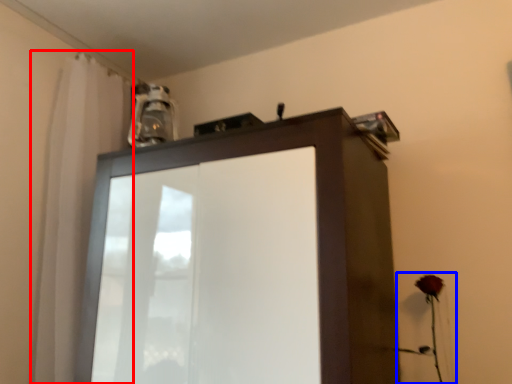
Question: Which point is further to the camera, shower curtain (highlighted by a red box) or flower (highlighted by a blue box)?

Choices:
 (A) shower curtain
 (B) flower

Answer: (A)